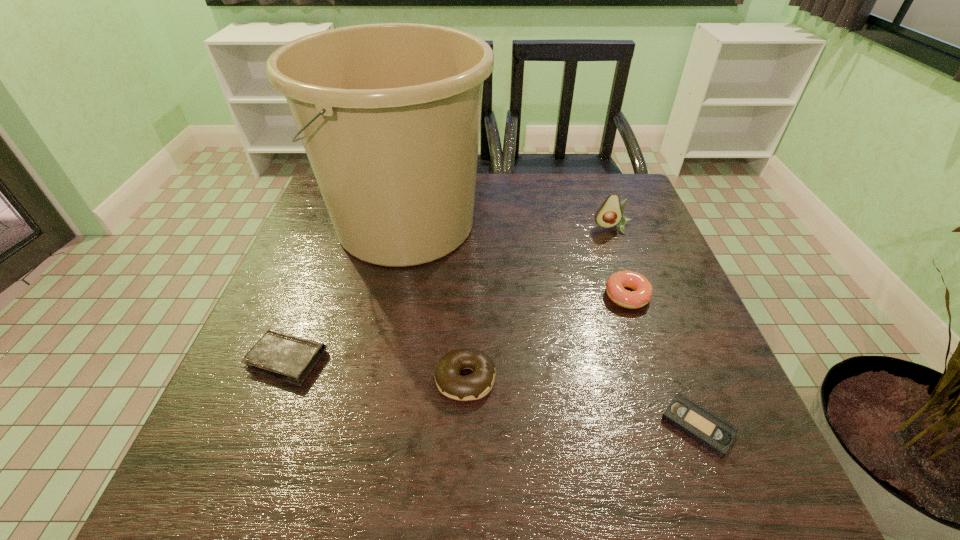
Locate an element on the screen. This screenshot has width=960, height=540. the tallest object is located at coordinates 389,114.

This screenshot has width=960, height=540. Identify the location of the fifth shortest object. (609, 214).

Locate an element on the screen. This screenshot has width=960, height=540. the right doughnut is located at coordinates (642, 293).

At what (x,y) coordinates should I click in order to perform the action: click on the nearer doughnut. Please return your answer as a coordinate pair (x, y). Looking at the image, I should click on (447, 374).

At what (x,y) coordinates should I click in order to perform the action: click on the fifth tallest object. Please return your answer as a coordinate pair (x, y). The width and height of the screenshot is (960, 540). Looking at the image, I should click on (290, 358).

Identify the location of the shortest object. (708, 429).

Locate an element on the screen. The image size is (960, 540). free space located 0.150m on the front of the tallest object is located at coordinates (384, 333).

At what (x,y) coordinates should I click in order to perform the action: click on free spot located 0.380m on the seed side of the avocado. Please return your answer as a coordinate pair (x, y). Image resolution: width=960 pixels, height=540 pixels. Looking at the image, I should click on (658, 350).

Find the location of a particular element. Image resolution: width=960 pixels, height=540 pixels. free location located 0.320m on the back of the right doughnut is located at coordinates (596, 204).

Where is `blank area located 0.050m on the left of the nearer doughnut`? The width and height of the screenshot is (960, 540). blank area located 0.050m on the left of the nearer doughnut is located at coordinates (409, 379).